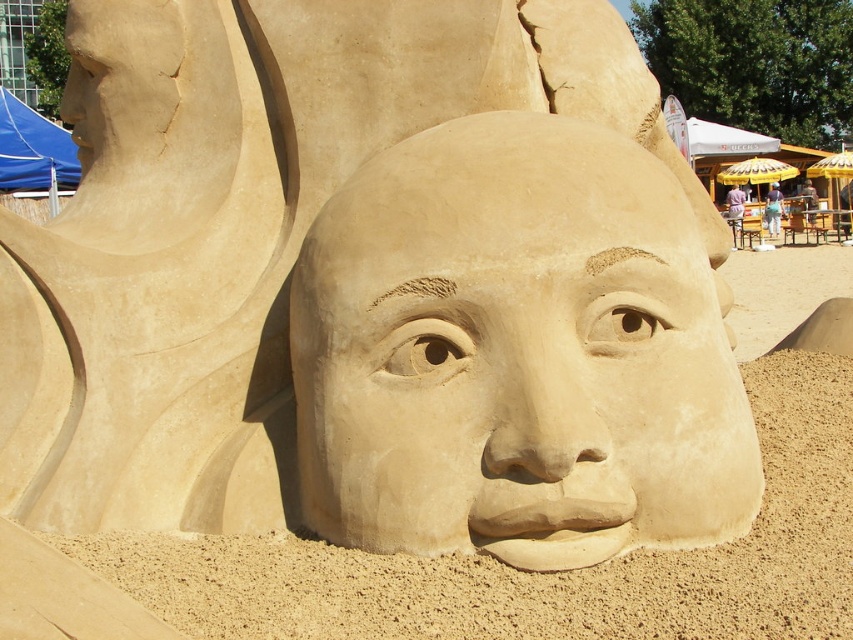
Question: Is the position of smooth sand sculpture at center more distant than that of smooth sand face at center?

Choices:
 (A) no
 (B) yes

Answer: (B)

Question: Which of the following is the farthest from the observer?

Choices:
 (A) (317, 356)
 (B) (383, 554)

Answer: (A)

Question: Among these objects, which one is nearest to the camera?

Choices:
 (A) smooth sand face at center
 (B) smooth sand sculpture at center

Answer: (A)

Question: Does smooth sand sculpture at center have a greater width compared to smooth sand face at center?

Choices:
 (A) no
 (B) yes

Answer: (A)

Question: Where is smooth sand sculpture at center located in relation to smooth sand face at center in the image?

Choices:
 (A) left
 (B) right

Answer: (A)